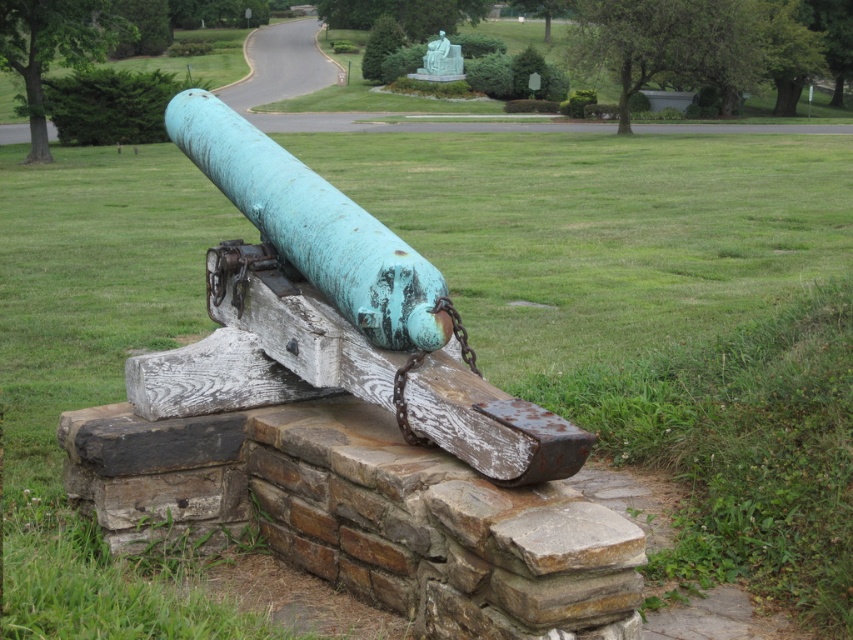
You are a park maintenance worker who needs to assess the height of the green patina metal cannon at center and the rusty wood log at center. Which object is taller?

The green patina metal cannon at center is much taller than the rusty wood log at center.

You are a park maintenance worker who needs to move the green patina metal cannon at center and the rusty wood log at center to clear a path for a new tree planting. Based on their positions, which object should you move first to ensure you can access the other afterward?

The green patina metal cannon at center is in front of the rusty wood log at center. Therefore, you should move the green patina metal cannon at center first to access the rusty wood log at center behind it.

You are a park maintenance worker who needs to inspect both the green patina metal cannon at center and the rusty wood log at center. Based on their positions, which object should you check first if you start from ground level and move upwards?

You should check the rusty wood log at center first because the green patina metal cannon at center is located below it, so the log is higher up and accessible first when moving upward from the ground.